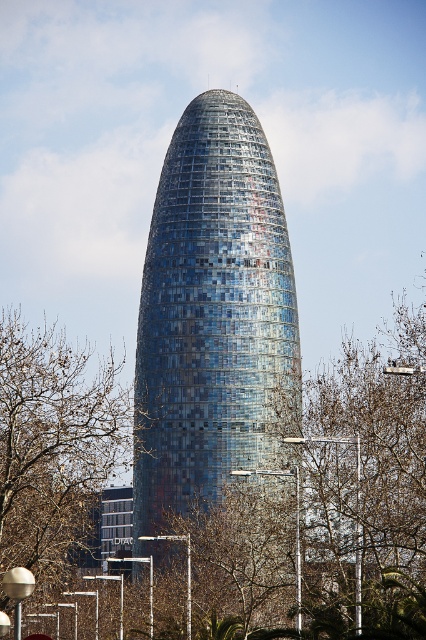
Question: Which point is farther from the camera taking this photo?

Choices:
 (A) (51, 358)
 (B) (281, 316)

Answer: (A)

Question: Considering the relative positions of blue glassy tower at center and brown leafless tree at left in the image provided, where is blue glassy tower at center located with respect to brown leafless tree at left?

Choices:
 (A) below
 (B) above

Answer: (B)

Question: Is blue glassy tower at center below brown leafless tree at left?

Choices:
 (A) yes
 (B) no

Answer: (B)

Question: Which point appears closest to the camera in this image?

Choices:
 (A) (222, 417)
 (B) (40, 515)

Answer: (A)

Question: Does blue glassy tower at center come behind brown leafless tree at left?

Choices:
 (A) yes
 (B) no

Answer: (B)